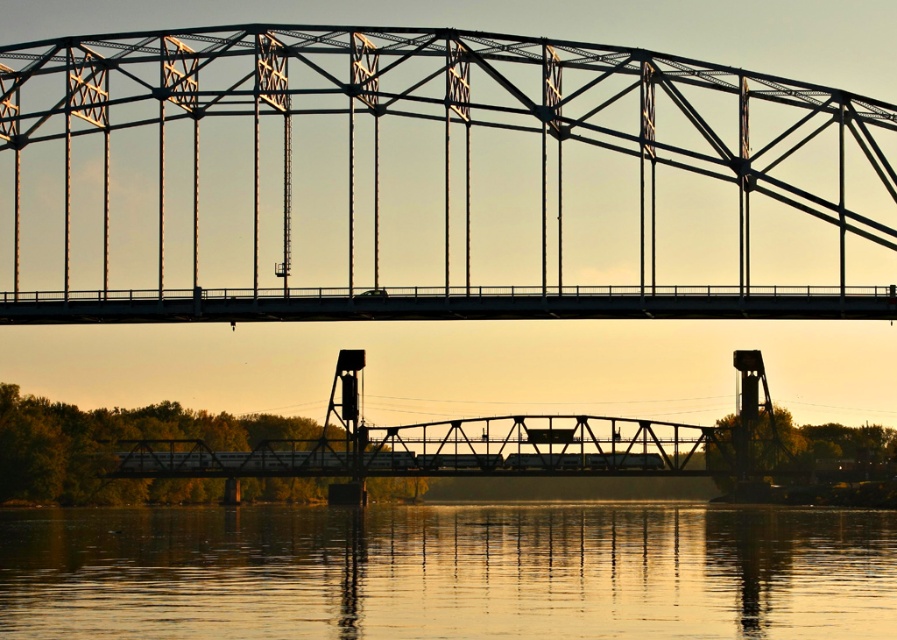
Does black steel bridge at center have a smaller size compared to smooth gold water at lower center?

Incorrect, black steel bridge at center is not smaller in size than smooth gold water at lower center.

Image resolution: width=897 pixels, height=640 pixels. What are the coordinates of `black steel bridge at center` in the screenshot? It's located at (430, 180).

The height and width of the screenshot is (640, 897). Identify the location of black steel bridge at center. (430, 180).